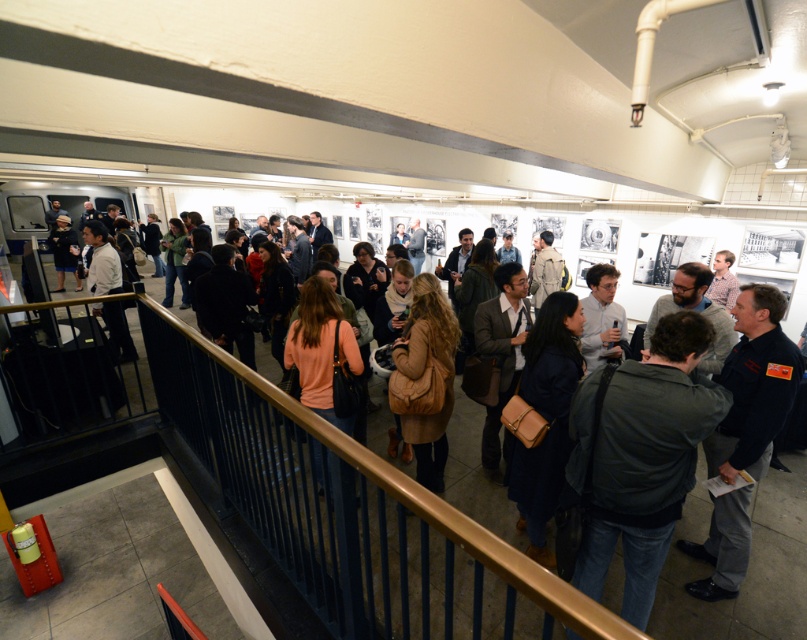
Between black uniform at center and matte black jacket at center, which one has less height?

Standing shorter between the two is matte black jacket at center.

Is point (755, 380) farther from camera compared to point (105, 228)?

No.

I want to click on black uniform at center, so click(755, 385).

Which of these two, dark green jacket at center or light gray shirt at center, stands shorter?

light gray shirt at center is shorter.

Between dark green jacket at center and light gray shirt at center, which one is positioned lower?

dark green jacket at center is lower down.

What do you see at coordinates (640, 458) in the screenshot? This screenshot has width=807, height=640. I see `dark green jacket at center` at bounding box center [640, 458].

The height and width of the screenshot is (640, 807). Find the location of `dark green jacket at center`. dark green jacket at center is located at coordinates (640, 458).

Between point (295, 442) and point (588, 566), which one is positioned behind?

Point (295, 442)

Is black metal railing at center behind dark green jacket at center?

No, it is not.

This screenshot has width=807, height=640. What do you see at coordinates (312, 509) in the screenshot? I see `black metal railing at center` at bounding box center [312, 509].

The width and height of the screenshot is (807, 640). I want to click on black metal railing at center, so click(x=312, y=509).